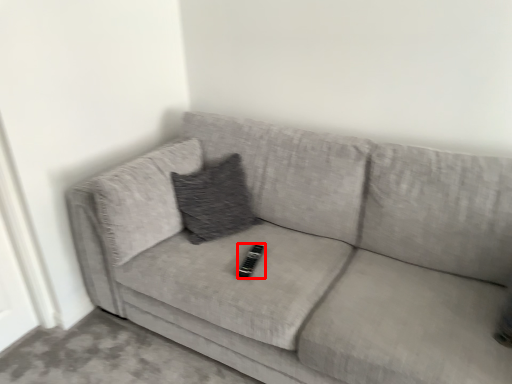
Question: Observing the image, what is the correct spatial positioning of remote (annotated by the red box) in reference to studio couch?

Choices:
 (A) right
 (B) left

Answer: (B)